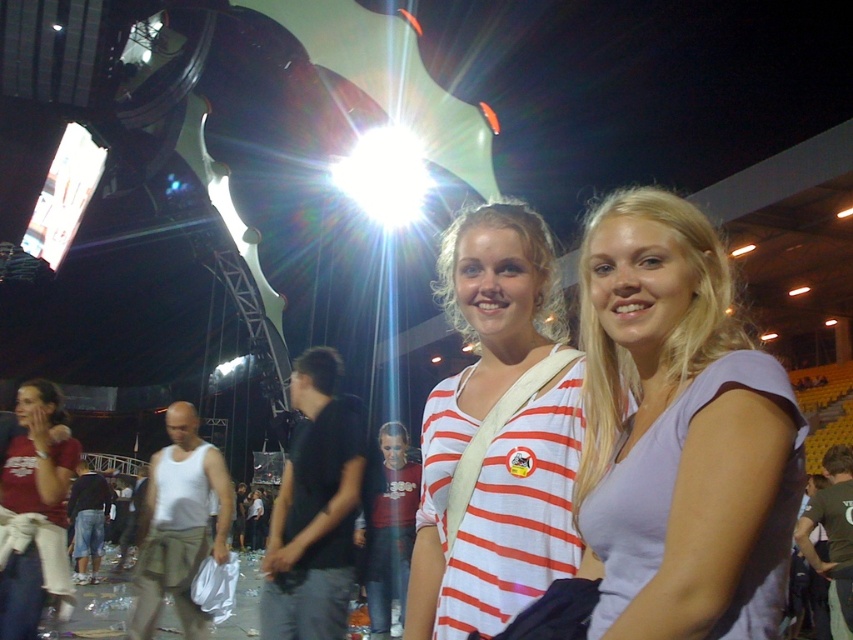
You are a photographer trying to capture a clear photo of both the white striped shirt at center and the black cotton shirt at center. However, the bright spotlight in the center is causing glare. Which shirt should you focus on first to avoid the glare?

The white striped shirt at center is positioned over black cotton shirt at center, so focusing on the black cotton shirt at center first would avoid the glare from the spotlight since it is underneath and less likely to be directly in the light.

You are a photographer at the event and want to capture both the white striped shirt at center and the black cotton shirt at center in a single shot. Considering their heights, which one might appear larger in the photo?

The white striped shirt at center is much taller than the black cotton shirt at center, so it will appear larger in the photo.

You are a photographer at the event and want to capture a photo of both the black cotton shirt at center and the white cotton tank top at center without any blur. Your camera has a depth of field that can focus on objects within a 5 meter range. Will both subjects be in focus?

The black cotton shirt at center is 4.86 meters from the white cotton tank top at center. Since the distance between them is within the 5 meter range, both subjects will be in focus.